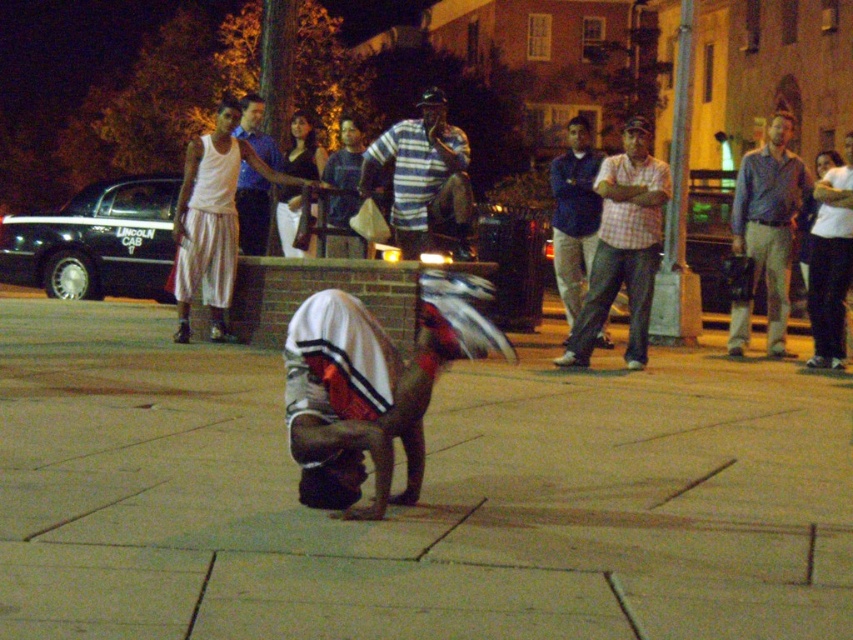
You are a photographer at the scene and want to capture both the white cotton tank top at upper center and the striped cotton shirt at center in a single frame. Which clothing item will appear bigger in the photo?

The white cotton tank top at upper center will appear bigger in the photo because it is larger in size than the striped cotton shirt at center.

You are a photographer at the scene and want to capture a photo of the plaid shirt at center and blue denim jeans at center. Which one should you focus on to ensure the subject in front is sharp?

The plaid shirt at center should be focused on because it is in front of the blue denim jeans at center, so focusing on the plaid shirt at center will keep the front subject sharp.

You are a photographer positioned at point [624,246]. What is the closest object to you in the scene?

The closest object to you at point [624,246] is the plaid shirt at center.